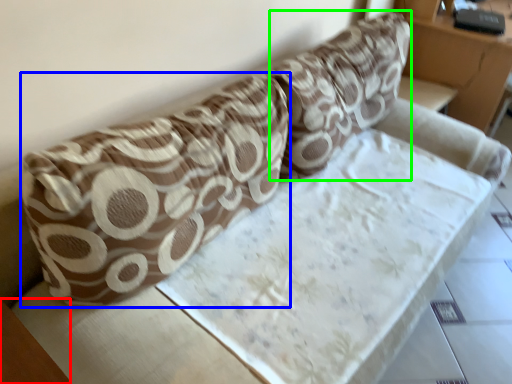
Question: Which object is the closest to the table (highlighted by a red box)? Choose among these: throw pillow (highlighted by a blue box) or throw pillow (highlighted by a green box).

Choices:
 (A) throw pillow
 (B) throw pillow

Answer: (A)